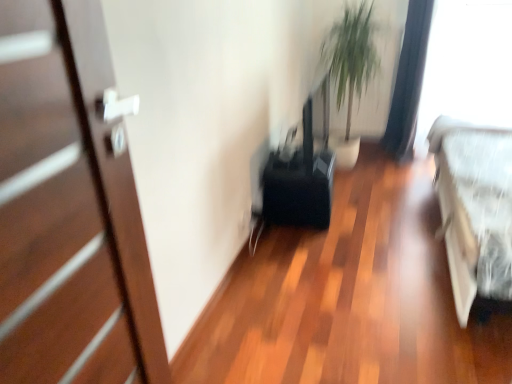
At what (x,y) coordinates should I click in order to perform the action: click on free space to the left of black fabric curtain at upper right. Please return your answer as a coordinate pair (x, y). The height and width of the screenshot is (384, 512). Looking at the image, I should click on (x=374, y=156).